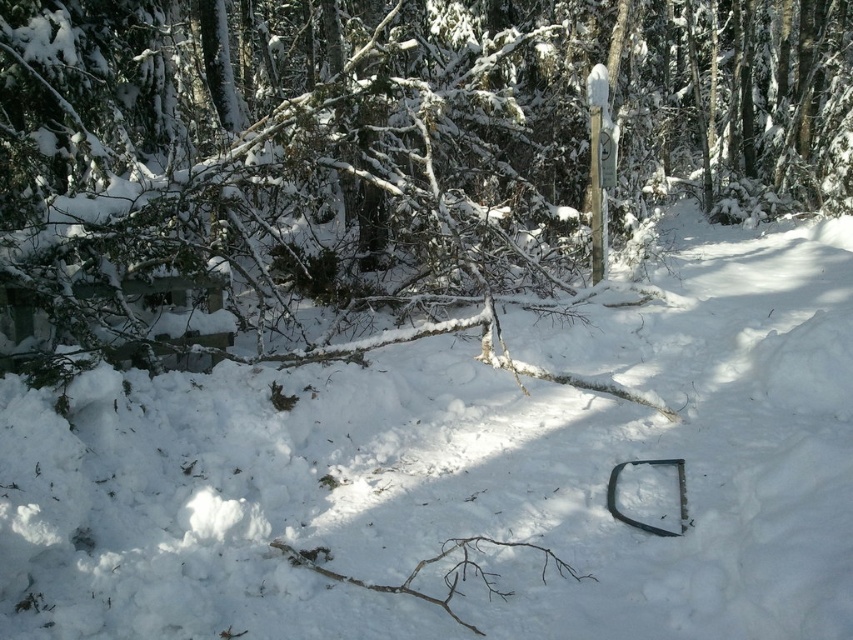
Question: Which point is farther from the camera taking this photo?

Choices:
 (A) (263, 384)
 (B) (352, 124)

Answer: (B)

Question: Is white matte snow at center smaller than snow-covered branch at center?

Choices:
 (A) yes
 (B) no

Answer: (A)

Question: Can you confirm if white matte snow at center is smaller than snow-covered branch at center?

Choices:
 (A) no
 (B) yes

Answer: (B)

Question: Is white matte snow at center wider than snow-covered branch at center?

Choices:
 (A) yes
 (B) no

Answer: (B)

Question: Which point is farther to the camera?

Choices:
 (A) white matte snow at center
 (B) snow-covered branch at center

Answer: (B)

Question: Which of the following is the farthest from the observer?

Choices:
 (A) (413, 244)
 (B) (155, 460)

Answer: (A)